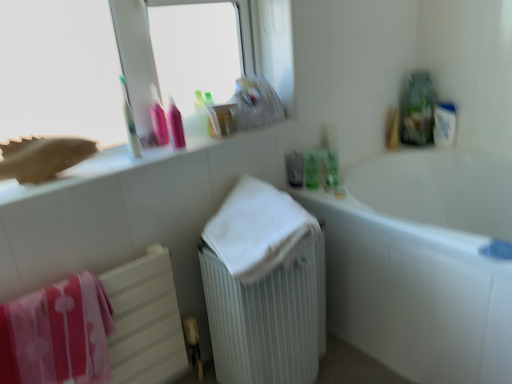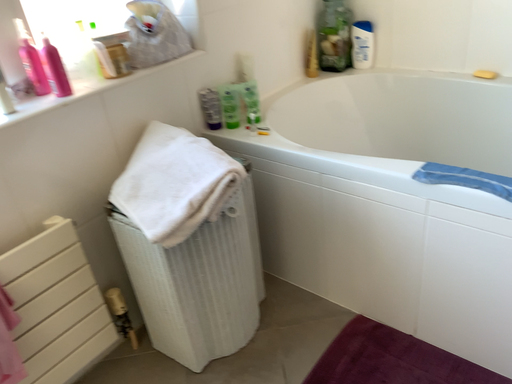
Question: Which way did the camera rotate in the video?

Choices:
 (A) rotated upward
 (B) rotated downward

Answer: (B)